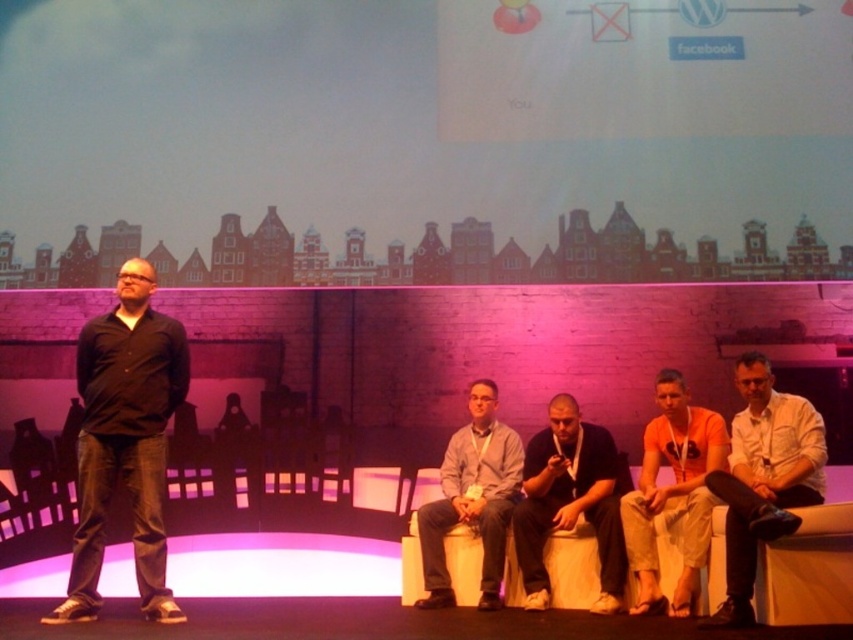
Question: Which object appears farthest from the camera in this image?

Choices:
 (A) black matte shirt at left
 (B) orange cotton shirt at center
 (C) gray fabric pants at lower center

Answer: (C)

Question: Does dark gray fabric shirt at center appear on the left side of orange cotton shirt at center?

Choices:
 (A) yes
 (B) no

Answer: (A)

Question: Which object is farther from the camera taking this photo?

Choices:
 (A) gray fabric pants at lower center
 (B) dark gray fabric shirt at center
 (C) white cotton shirt at lower right
 (D) orange cotton shirt at center

Answer: (A)

Question: Considering the relative positions of white cotton shirt at lower right and gray fabric pants at lower center in the image provided, where is white cotton shirt at lower right located with respect to gray fabric pants at lower center?

Choices:
 (A) right
 (B) left

Answer: (A)

Question: Does white cotton shirt at lower right appear under gray fabric pants at lower center?

Choices:
 (A) no
 (B) yes

Answer: (A)

Question: Which object is farther from the camera taking this photo?

Choices:
 (A) dark gray fabric shirt at center
 (B) white cotton shirt at lower right
 (C) orange cotton shirt at center

Answer: (A)